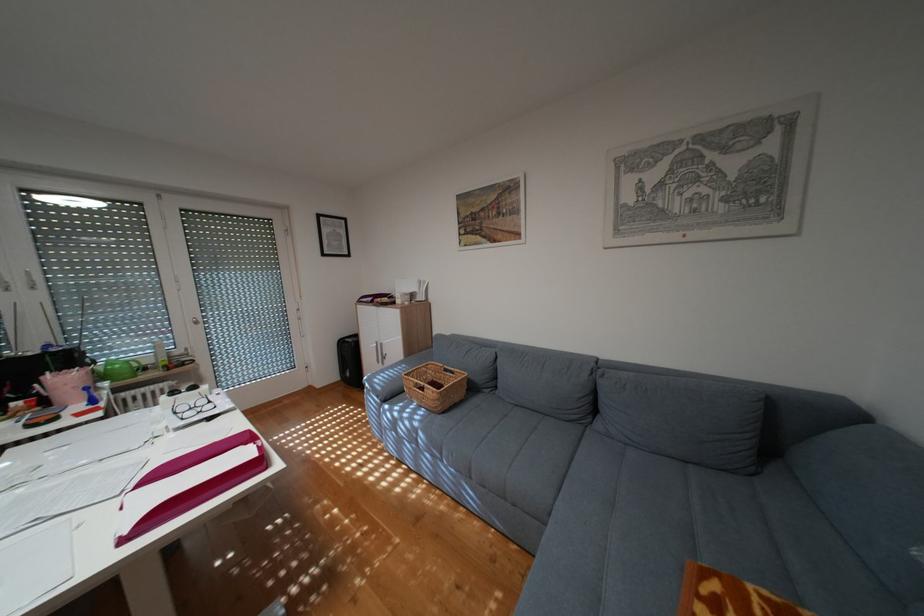
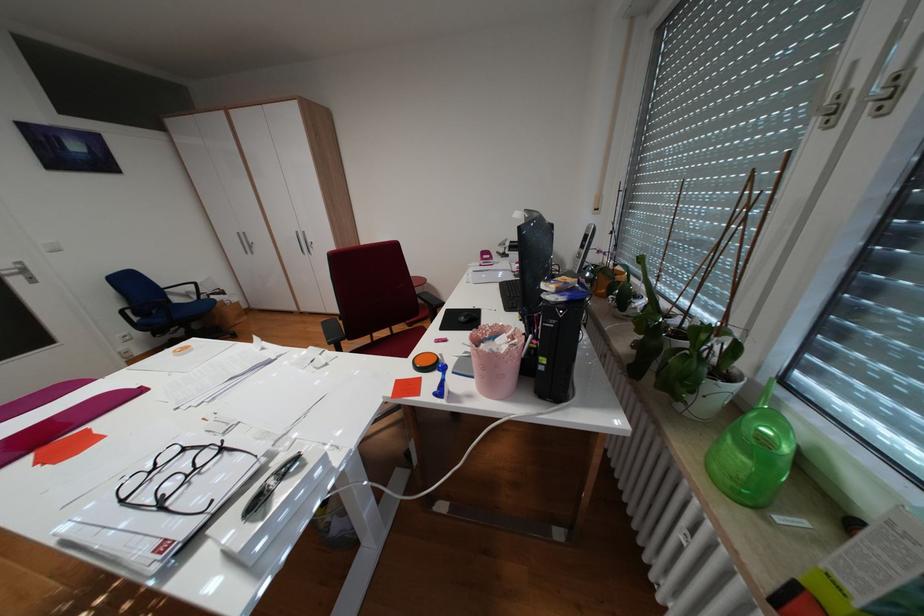
The point at (222, 400) is marked in the first image. Where is the corresponding point in the second image?

(173, 505)